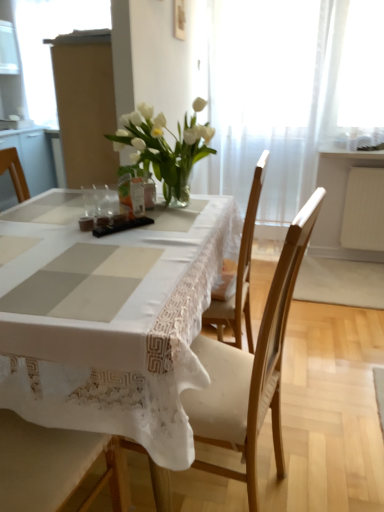
Where is `vacant region below white glass vase at center (from a real-world perspective)`? vacant region below white glass vase at center (from a real-world perspective) is located at coordinates (188, 206).